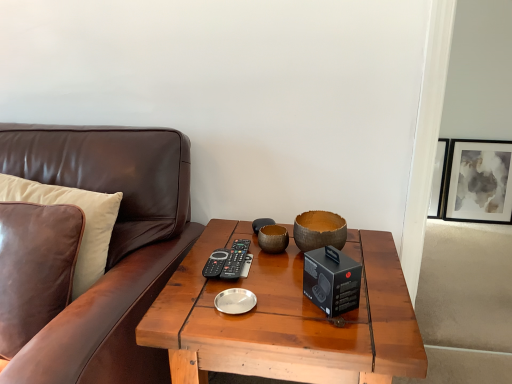
Question: Can you confirm if matte black picture frame at upper right is wider than brown leather couch at left?

Choices:
 (A) no
 (B) yes

Answer: (A)

Question: Is matte black picture frame at upper right looking in the opposite direction of brown leather couch at left?

Choices:
 (A) yes
 (B) no

Answer: (B)

Question: From a real-world perspective, is matte black picture frame at upper right beneath brown leather couch at left?

Choices:
 (A) no
 (B) yes

Answer: (B)

Question: Can you confirm if matte black picture frame at upper right is taller than brown leather couch at left?

Choices:
 (A) yes
 (B) no

Answer: (B)

Question: Considering the relative sizes of matte black picture frame at upper right and brown leather couch at left in the image provided, is matte black picture frame at upper right thinner than brown leather couch at left?

Choices:
 (A) yes
 (B) no

Answer: (A)

Question: Is point (343, 231) positioned closer to the camera than point (481, 201)?

Choices:
 (A) farther
 (B) closer

Answer: (B)

Question: In terms of size, does natural wood bowl at center appear bigger or smaller than matte black picture frame at upper right?

Choices:
 (A) big
 (B) small

Answer: (B)

Question: Considering the positions of natural wood bowl at center and matte black picture frame at upper right in the image, is natural wood bowl at center taller or shorter than matte black picture frame at upper right?

Choices:
 (A) tall
 (B) short

Answer: (B)

Question: Is natural wood bowl at center wider or thinner than matte black picture frame at upper right?

Choices:
 (A) wide
 (B) thin

Answer: (A)

Question: In the image, is leather pillow at left positioned in front of or behind natural wood bowl at center?

Choices:
 (A) behind
 (B) front

Answer: (B)

Question: From a real-world perspective, relative to natural wood bowl at center, is leather pillow at left vertically above or below?

Choices:
 (A) below
 (B) above

Answer: (A)

Question: Do you think leather pillow at left is within natural wood bowl at center, or outside of it?

Choices:
 (A) outside
 (B) inside

Answer: (A)

Question: In terms of height, does leather pillow at left look taller or shorter compared to natural wood bowl at center?

Choices:
 (A) short
 (B) tall

Answer: (B)

Question: Is leather pillow at left bigger or smaller than brown leather couch at left?

Choices:
 (A) big
 (B) small

Answer: (B)

Question: Does point (74, 284) appear closer or farther from the camera than point (141, 314)?

Choices:
 (A) farther
 (B) closer

Answer: (A)